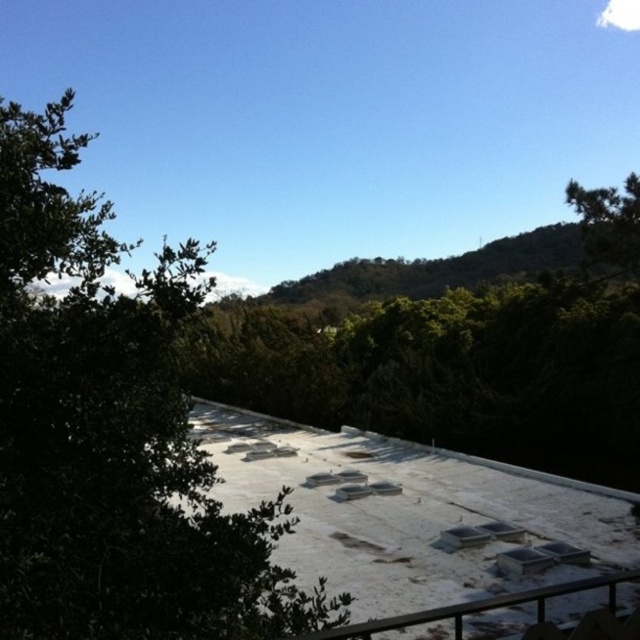
Question: Based on their relative distances, which object is farther from the green leafy tree at left?

Choices:
 (A) white matte rail at lower right
 (B) green leafy tree at upper right

Answer: (B)

Question: Is green leafy tree at left below green leafy tree at upper right?

Choices:
 (A) yes
 (B) no

Answer: (B)

Question: Which of the following is the farthest from the observer?

Choices:
 (A) green leafy tree at left
 (B) green leafy tree at upper right
 (C) white matte rail at lower right

Answer: (B)

Question: Which object appears closest to the camera in this image?

Choices:
 (A) green leafy tree at left
 (B) white matte rail at lower right

Answer: (A)

Question: Where is green leafy tree at left located in relation to white matte rail at lower right in the image?

Choices:
 (A) right
 (B) left

Answer: (B)

Question: Is green leafy tree at left smaller than white matte rail at lower right?

Choices:
 (A) no
 (B) yes

Answer: (A)